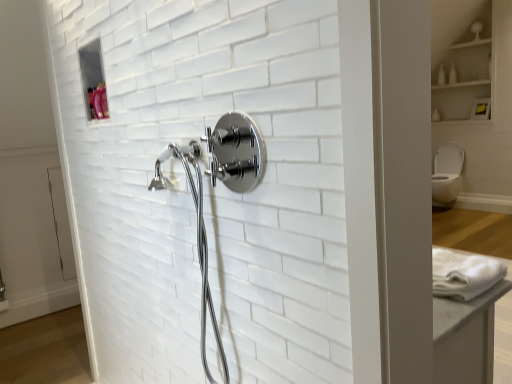
Question: Is point (190, 175) closer or farther from the camera than point (439, 69)?

Choices:
 (A) farther
 (B) closer

Answer: (B)

Question: From a real-world perspective, is chrome/metallic showerhead at center positioned above or below white glossy bottle at upper right?

Choices:
 (A) above
 (B) below

Answer: (B)

Question: Considering the real-world distances, which object is farthest from the chrome/metallic showerhead at center?

Choices:
 (A) white glossy bottle at upper right
 (B) white glossy toilet bowl at right
 (C) white glossy cabinet at upper right

Answer: (A)

Question: Which of these objects is positioned farthest from the white glossy bottle at upper right?

Choices:
 (A) chrome/metallic showerhead at center
 (B) white glossy toilet bowl at right
 (C) white glossy cabinet at upper right

Answer: (A)